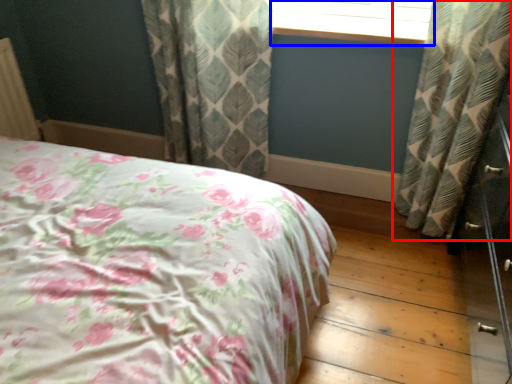
Question: Which object is further to the camera taking this photo, curtain (highlighted by a red box) or window frame (highlighted by a blue box)?

Choices:
 (A) curtain
 (B) window frame

Answer: (B)